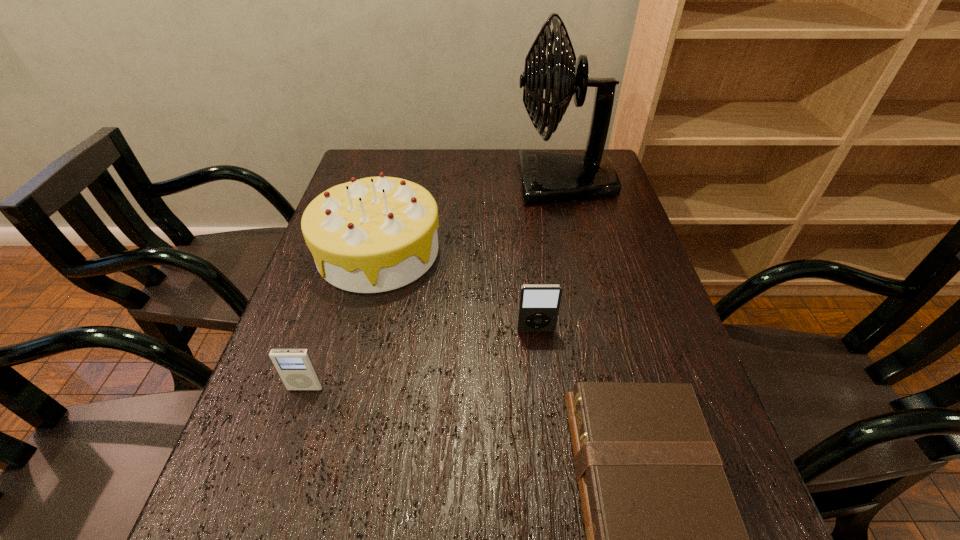
Image resolution: width=960 pixels, height=540 pixels. Find the location of `free location that satisfies the following two spatial constraints: 1. in front of the fan to blow air; 2. on the front-facing side of the left iPod`. free location that satisfies the following two spatial constraints: 1. in front of the fan to blow air; 2. on the front-facing side of the left iPod is located at coordinates (614, 388).

The height and width of the screenshot is (540, 960). Identify the location of free spot that satisfies the following two spatial constraints: 1. in front of the fan to blow air; 2. on the front-facing side of the right iPod. (600, 330).